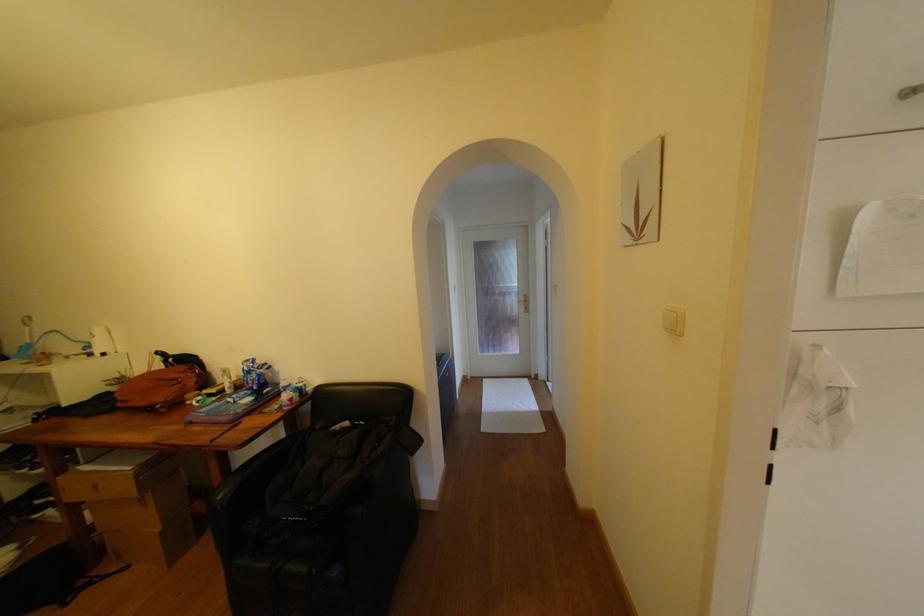
Where is `brown leather bag`? brown leather bag is located at coordinates (160, 387).